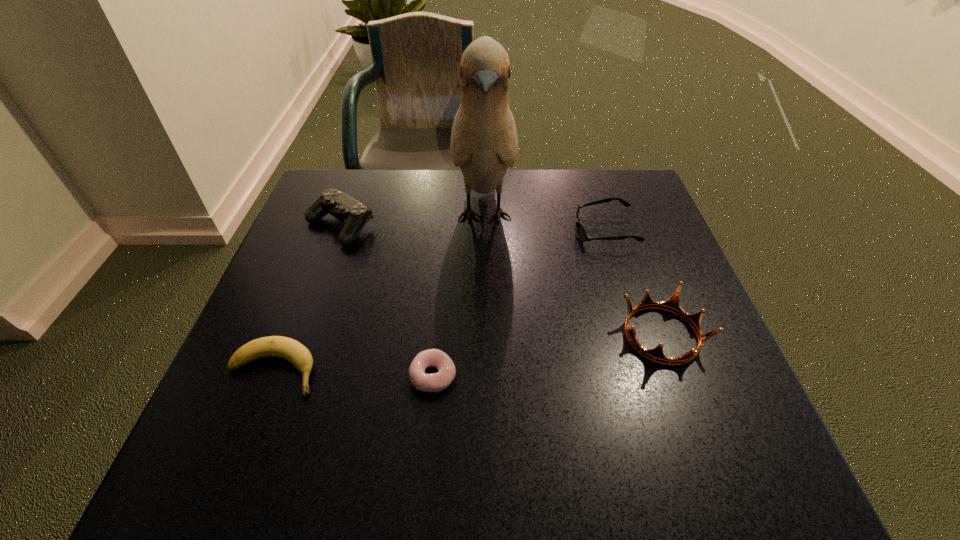
You are a GUI agent. You are given a task and a screenshot of the screen. Output one action in this format:
    pyautogui.click(x=<x>, y=<y>)
    Task: Click on the free region located on the lenses of the sunglasses
    Image resolution: width=960 pixels, height=540 pixels.
    Given the screenshot: What is the action you would take?
    pyautogui.click(x=437, y=231)

Find the location of `free point located 0.310m on the lenses of the sunglasses`. free point located 0.310m on the lenses of the sunglasses is located at coordinates (449, 231).

This screenshot has height=540, width=960. Identify the location of vacant region located on the back of the banana. (320, 249).

What are the coordinates of `vacant space located on the left of the doughnut` in the screenshot? It's located at (344, 376).

Where is `parakeet present at the far edge`? parakeet present at the far edge is located at coordinates (484, 143).

This screenshot has height=540, width=960. I want to click on control that is at the far edge, so click(x=354, y=214).

This screenshot has width=960, height=540. I want to click on sunglasses that is at the far edge, so click(x=582, y=234).

Image resolution: width=960 pixels, height=540 pixels. I want to click on control present at the left edge, so click(354, 214).

Locate an element on the screen. This screenshot has height=540, width=960. banana situated at the left edge is located at coordinates (297, 354).

Image resolution: width=960 pixels, height=540 pixels. I want to click on crown that is at the right edge, so click(x=656, y=354).